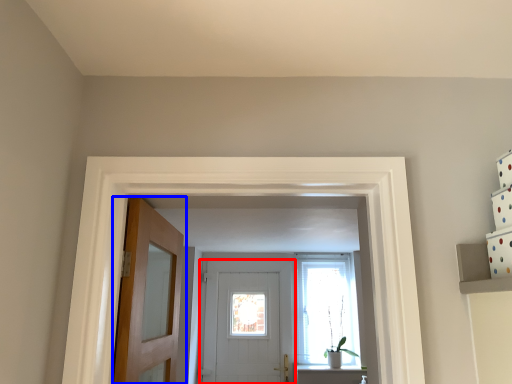
Question: Which point is further to the camera, door (highlighted by a red box) or door (highlighted by a blue box)?

Choices:
 (A) door
 (B) door

Answer: (A)